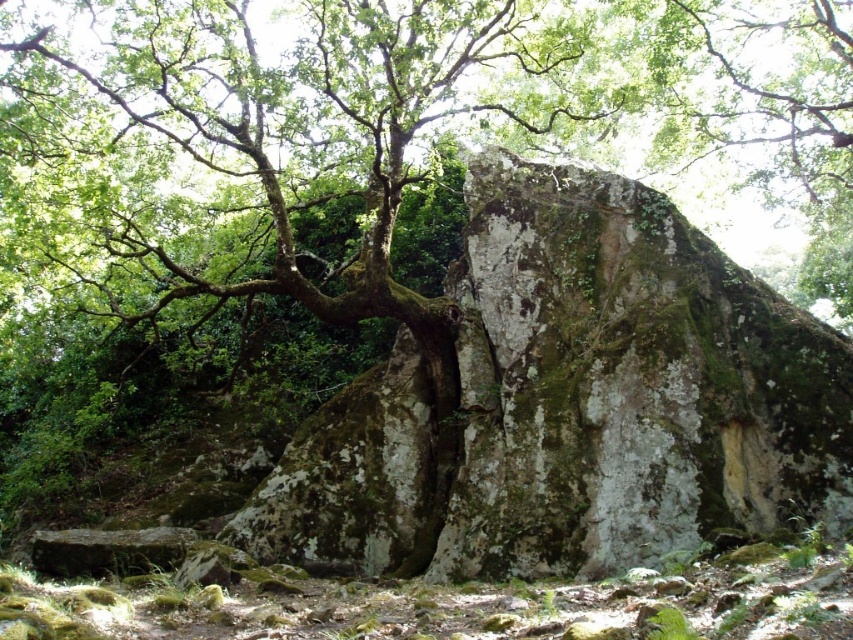
Is green mossy tree at center wider than green mossy rock at center?

Yes.

How distant is green mossy tree at center from green mossy rock at center?

The distance of green mossy tree at center from green mossy rock at center is 18.76 meters.

Which is behind, point (123, 256) or point (677, 433)?

Positioned behind is point (123, 256).

I want to click on green mossy tree at center, so click(337, 161).